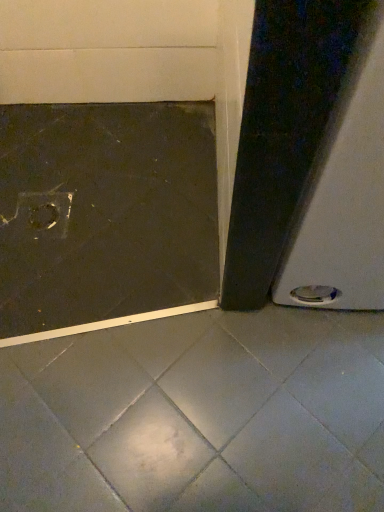
Question: Looking at their shapes, would you say dark matte concrete at lower left is wider or thinner than white glossy screen door at right?

Choices:
 (A) wide
 (B) thin

Answer: (A)

Question: In terms of height, does dark matte concrete at lower left look taller or shorter compared to white glossy screen door at right?

Choices:
 (A) short
 (B) tall

Answer: (A)

Question: Choose the correct answer: Is dark matte concrete at lower left inside white glossy screen door at right or outside it?

Choices:
 (A) inside
 (B) outside

Answer: (B)

Question: In terms of width, does white glossy screen door at right look wider or thinner when compared to dark matte concrete at lower left?

Choices:
 (A) wide
 (B) thin

Answer: (B)

Question: Is white glossy screen door at right inside the boundaries of dark matte concrete at lower left, or outside?

Choices:
 (A) outside
 (B) inside

Answer: (A)

Question: Considering the relative positions of white glossy screen door at right and dark matte concrete at lower left in the image provided, is white glossy screen door at right to the left or to the right of dark matte concrete at lower left?

Choices:
 (A) right
 (B) left

Answer: (A)

Question: Looking at the image, does white glossy screen door at right seem bigger or smaller compared to dark matte concrete at lower left?

Choices:
 (A) small
 (B) big

Answer: (B)